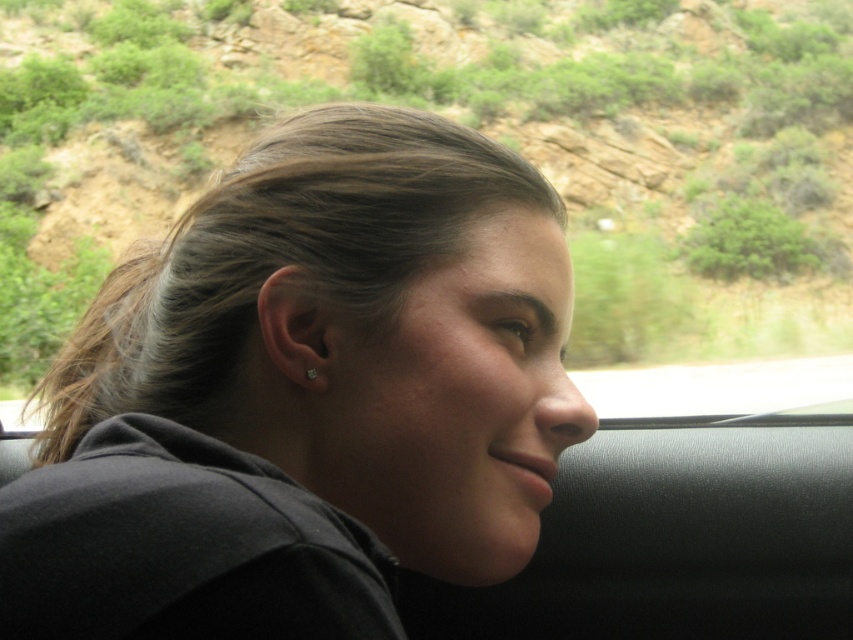
You are a photographer taking a portrait of the person in the vehicle. You notice the clear crystal earring at ear and the green grassy hillside at upper center. Which object is closer to the camera lens?

The clear crystal earring at ear is closer to the camera lens because it is positioned behind the green grassy hillside at upper center, meaning the earring is in front of the hillside in the scene.

You are a photographer trying to capture a portrait of the person with the matte black hair at center while also including the green grassy hillside at upper center in the background. Based on their sizes in the image, which object should you focus on first to ensure both are in focus?

The matte black hair at center has a smaller size compared to the green grassy hillside at upper center. To ensure both are in focus, you should focus on the matte black hair at center first since it is closer to the camera, and the larger hillside will naturally be in the background depth of field.